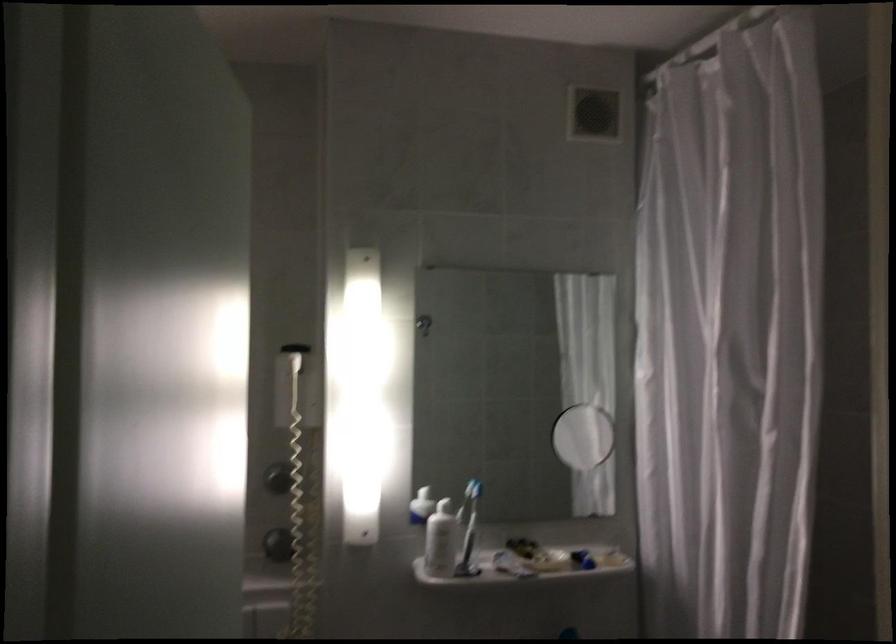
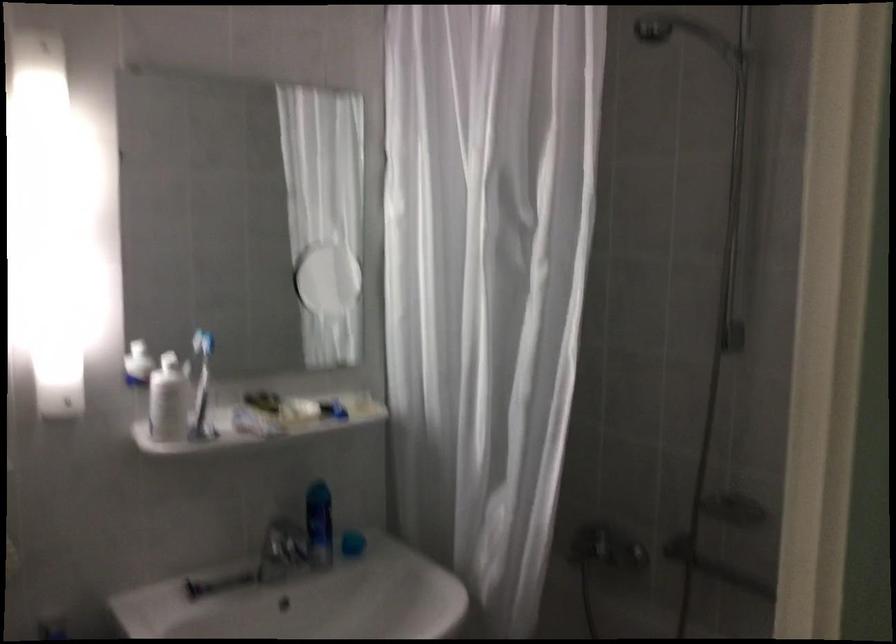
Question: What movement of the cameraman would produce the second image?

Choices:
 (A) Left
 (B) Right
 (C) Forward
 (D) Backward

Answer: (C)